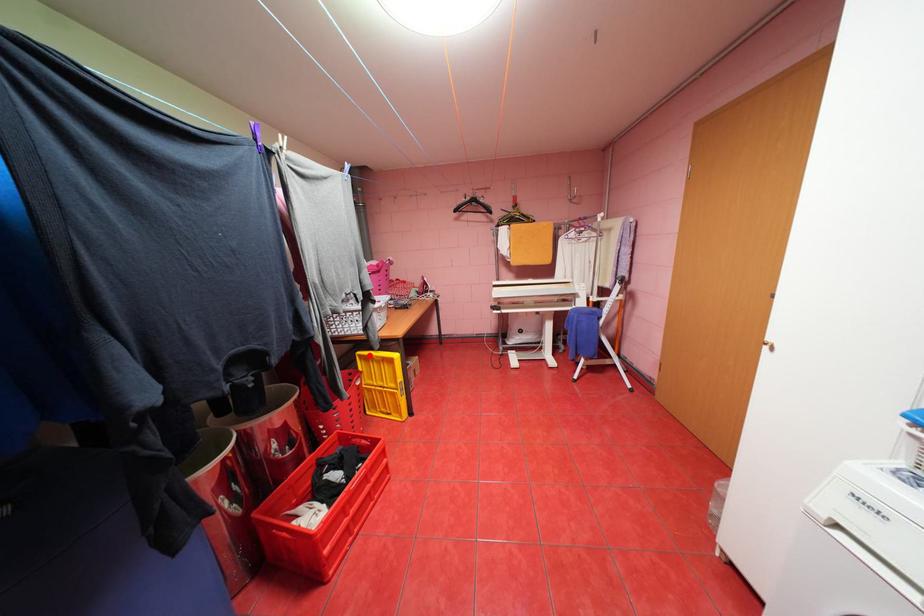
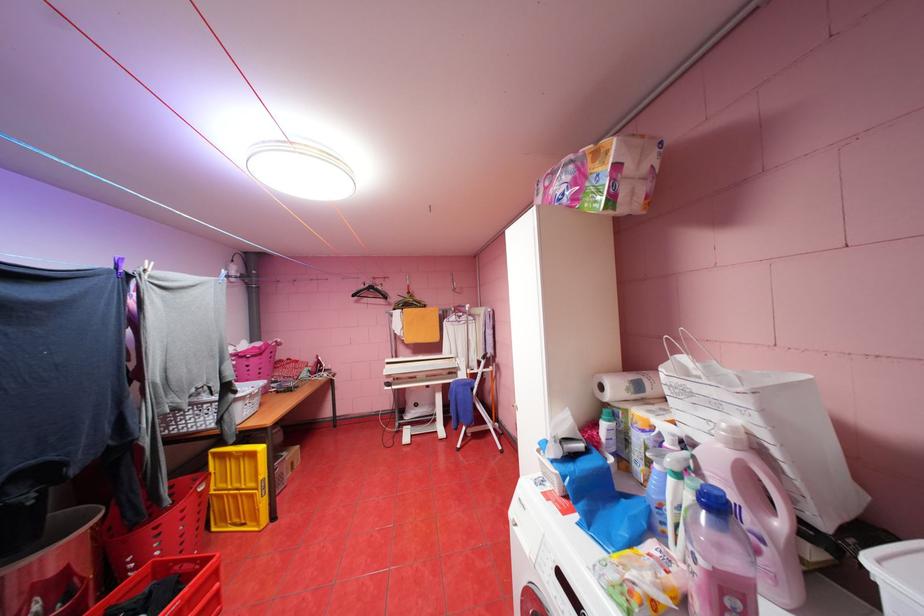
Where in the second image is the point corresponding to the highlighted location from the first image?

(224, 454)